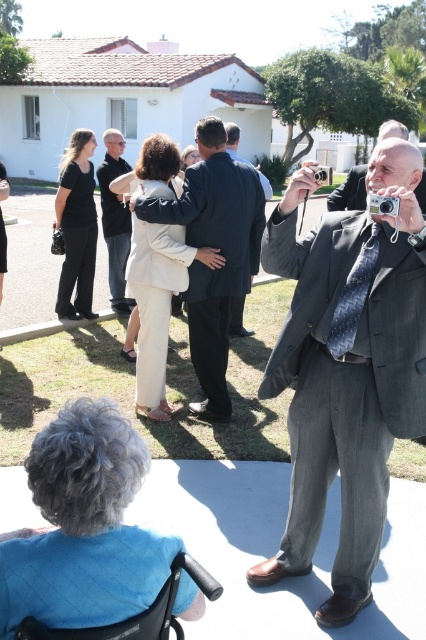
You are organizing a photo shoot and need to arrange two outfits for a catalog. The black matte pants at left and the gray suit at right must be placed side by side. Given their widths, which outfit should be placed on the left side to ensure they fit within the 1.5 meter wide display area without overlapping?

The black matte pants at left should be placed on the left side because their width is less than the gray suit at right, allowing both outfits to fit within the 1.5 meter display area without overlapping.

You are a photographer standing at the point where the gray suit at center is located. You want to take a photo of the white building with a red tiled roof. Is the wheelchair user in the foreground blocking your view of the building?

The gray suit at center is located at point (347, 369). The wheelchair user is in the foreground, so the photographer at the gray suit at center would have their view blocked by the wheelchair user in the foreground when trying to capture the white building with a red tiled roof.